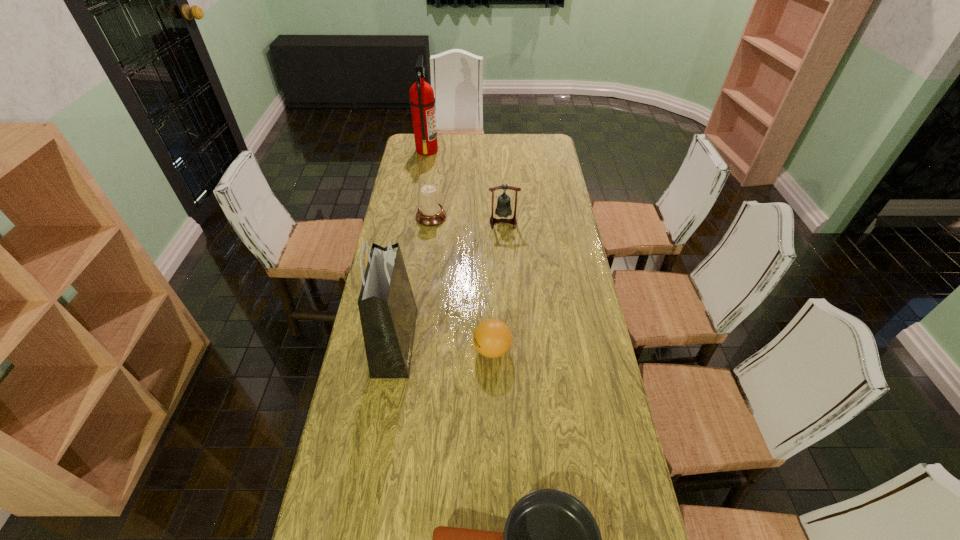
Image resolution: width=960 pixels, height=540 pixels. What are the coordinates of `free location located 0.160m on the side with brand of the ping-pong ball` in the screenshot? It's located at (422, 350).

Where is `blank space located on the side with brand of the ping-pong ball`? The width and height of the screenshot is (960, 540). blank space located on the side with brand of the ping-pong ball is located at coordinates (372, 350).

Find the location of a particular element. The height and width of the screenshot is (540, 960). object present at the far edge is located at coordinates (422, 100).

Identify the location of fire extinguisher located in the left edge section of the desktop. (422, 100).

The image size is (960, 540). In order to click on shopping bag located at the left edge in this screenshot , I will do `click(388, 312)`.

Find the location of a particular element. The image size is (960, 540). candle holder at the left edge is located at coordinates (430, 213).

I want to click on object that is at the far left corner, so click(x=422, y=100).

Find the location of `free point at the far edge`. free point at the far edge is located at coordinates (498, 151).

The height and width of the screenshot is (540, 960). In the image, there is a desktop. Find the location of `vacant space at the left edge`. vacant space at the left edge is located at coordinates (407, 244).

The image size is (960, 540). In order to click on vacant space at the right edge of the desktop in this screenshot , I will do `click(611, 397)`.